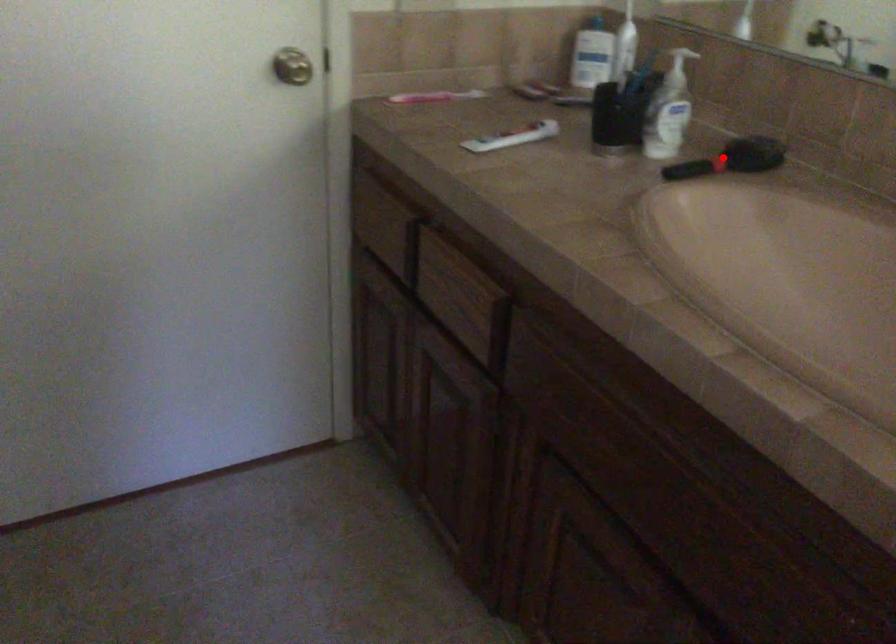
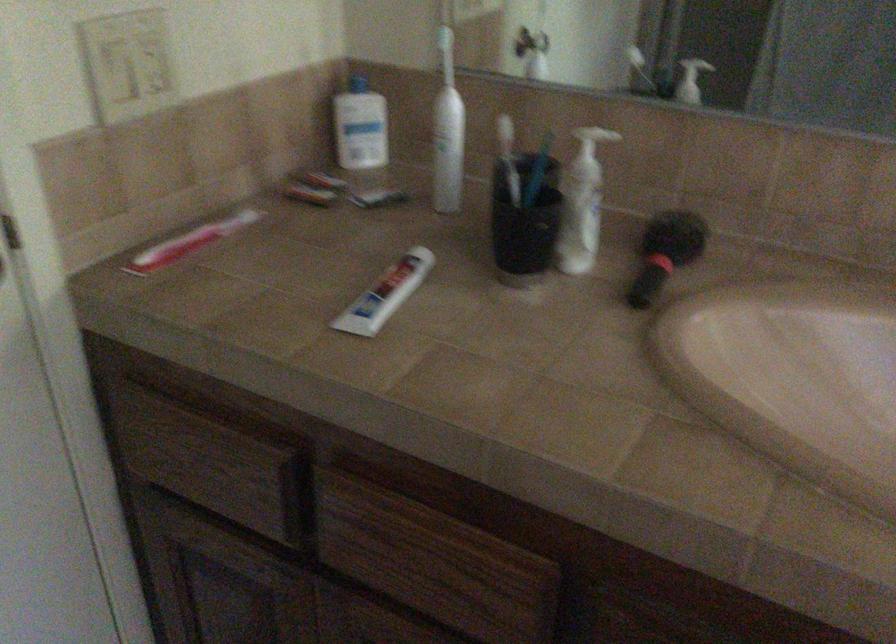
Question: I am providing you with two images of the same scene from different viewpoints. Given a red point in image1, look at the same physical point in image2. Is it:

Choices:
 (A) Closer to the viewpoint
 (B) Farther from the viewpoint

Answer: (A)